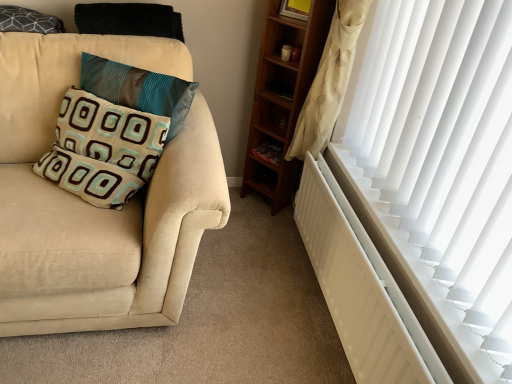
The image size is (512, 384). Find the location of `vacant area located to the right-hand side of suede beige couch at left`. vacant area located to the right-hand side of suede beige couch at left is located at coordinates (257, 286).